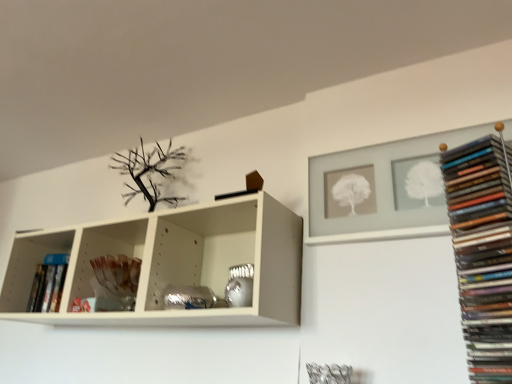
Question: From a real-world perspective, is white matte frame at upper right, placed as the first shelf when sorted from top to bottom, physically above matte black books at right, the 1th book from the right?

Choices:
 (A) no
 (B) yes

Answer: (B)

Question: From the image's perspective, is white matte frame at upper right, the 1th shelf positioned from the right, over matte black books at right, positioned as the 1th book in front-to-back order?

Choices:
 (A) no
 (B) yes

Answer: (B)

Question: Is white matte frame at upper right, placed as the first shelf when sorted from top to bottom, placed right next to matte black books at right, positioned as the 1th book in front-to-back order?

Choices:
 (A) no
 (B) yes

Answer: (A)

Question: Does white matte frame at upper right, placed as the first shelf when sorted from top to bottom, have a lesser height compared to matte black books at right, positioned as the 1th book in front-to-back order?

Choices:
 (A) no
 (B) yes

Answer: (B)

Question: From the image's perspective, is white matte frame at upper right, the 1th shelf positioned from the right, beneath matte black books at right, positioned as the 1th book in front-to-back order?

Choices:
 (A) yes
 (B) no

Answer: (B)

Question: Which is correct: hardcover book at left, arranged as the first book when viewed from the left, is inside translucent glass vase at center, placed as the 1th shelf when sorted from bottom to top, or outside of it?

Choices:
 (A) inside
 (B) outside

Answer: (B)

Question: From their relative heights in the image, would you say hardcover book at left, arranged as the first book when viewed from the left, is taller or shorter than translucent glass vase at center, the 2th shelf from the right?

Choices:
 (A) short
 (B) tall

Answer: (B)

Question: Is hardcover book at left, which ranks as the first book in back-to-front order, in front of or behind translucent glass vase at center, positioned as the first shelf in left-to-right order, in the image?

Choices:
 (A) behind
 (B) front

Answer: (A)

Question: From a real-world perspective, is hardcover book at left, which appears as the second book when viewed from the right, positioned above or below translucent glass vase at center, which ranks as the 2th shelf in top-to-bottom order?

Choices:
 (A) above
 (B) below

Answer: (A)

Question: Is matte black books at right, which is the second book in back-to-front order, in front of or behind hardcover book at left, which appears as the second book when viewed from the right, in the image?

Choices:
 (A) behind
 (B) front

Answer: (B)

Question: Is matte black books at right, the 1th book from the right, wider or thinner than hardcover book at left, the 2th book positioned from the front?

Choices:
 (A) wide
 (B) thin

Answer: (A)

Question: From a real-world perspective, is matte black books at right, which is the second book in back-to-front order, positioned above or below hardcover book at left, arranged as the first book when viewed from the left?

Choices:
 (A) above
 (B) below

Answer: (A)

Question: Based on their sizes in the image, would you say matte black books at right, which is the second book in back-to-front order, is bigger or smaller than hardcover book at left, arranged as the first book when viewed from the left?

Choices:
 (A) big
 (B) small

Answer: (A)

Question: Does point (81, 307) appear closer or farther from the camera than point (391, 236)?

Choices:
 (A) closer
 (B) farther

Answer: (B)

Question: Based on their positions, is translucent glass vase at center, the 2th shelf from the right, located to the left or right of white matte frame at upper right, the 1th shelf positioned from the right?

Choices:
 (A) right
 (B) left

Answer: (B)